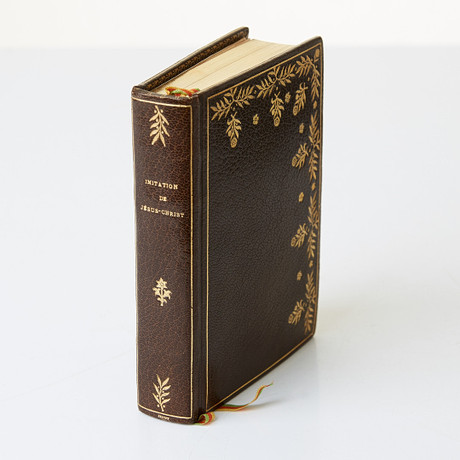
This screenshot has width=460, height=460. What are the coordinates of `book spine` in the screenshot? It's located at (154, 239).